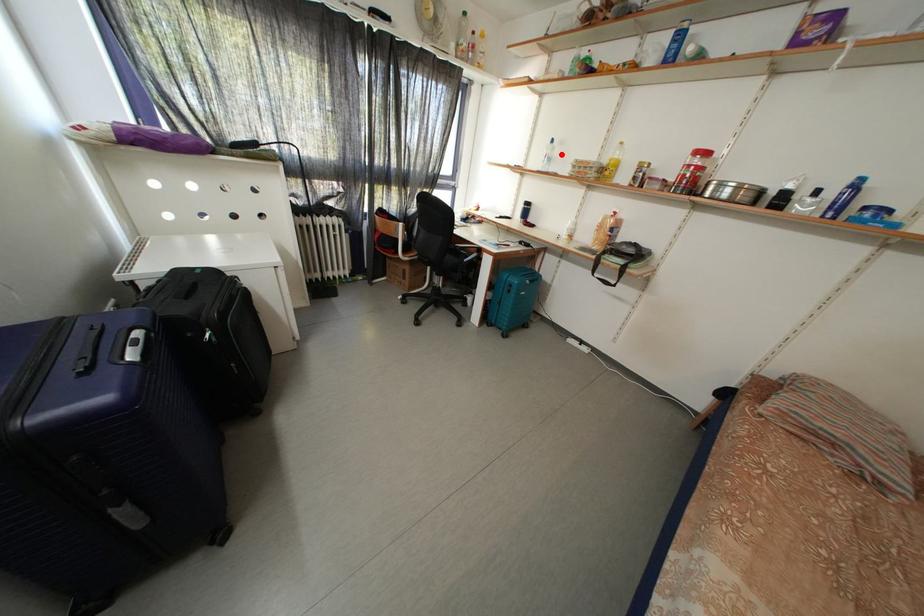
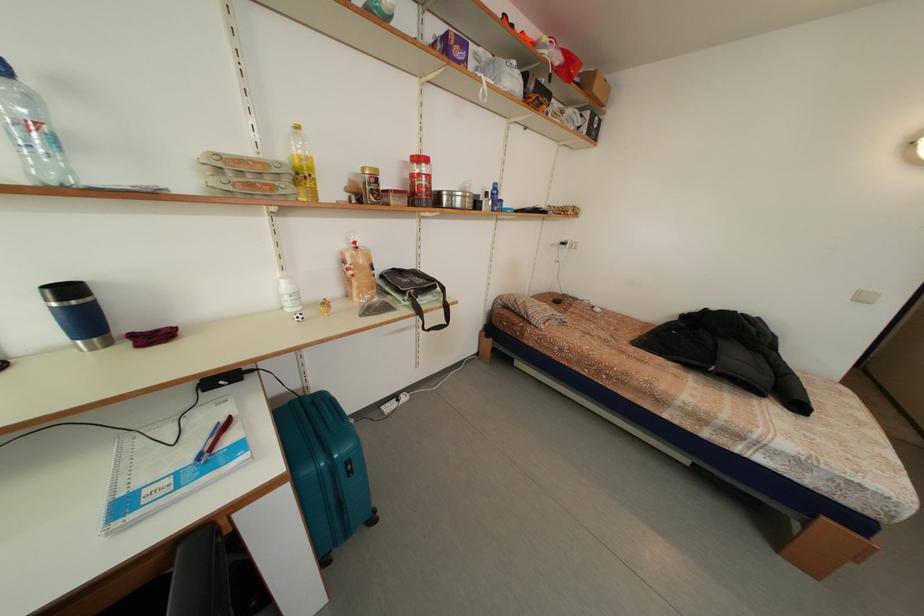
Question: I am providing you with two images of the same scene from different viewpoints. In image1, a red point is highlighted. Considering the same 3D point in image2, which of the following is correct?

Choices:
 (A) It is closer
 (B) It is farther

Answer: (B)